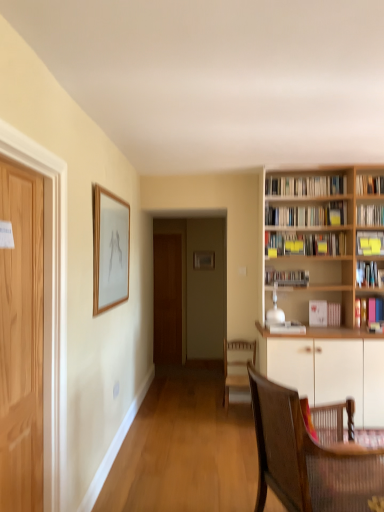
Locate an element on the screen. The image size is (384, 512). vacant region above yellow paper-covered book at center, marked as the 6th book in a bottom-to-top arrangement (from a real-world perspective) is located at coordinates (304, 227).